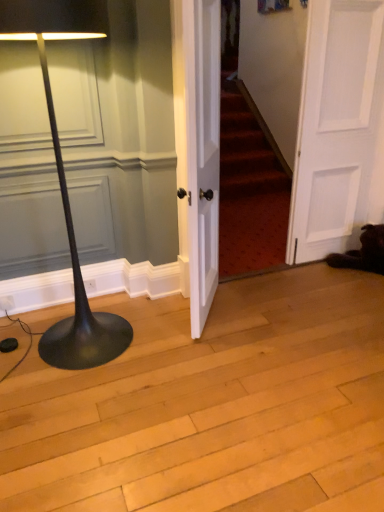
Identify the location of free spot to the right of white wood door at center, the first door positioned from the left. (259, 314).